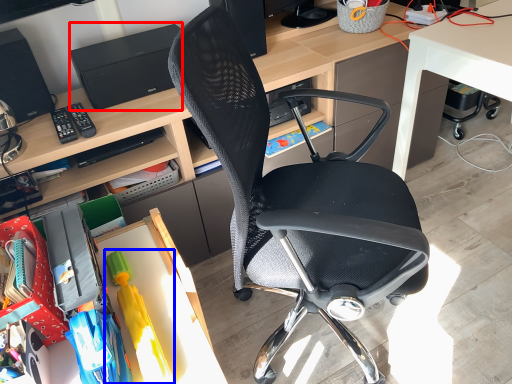
Question: Among these objects, which one is farthest to the camera, printer (highlighted by a red box) or toy (highlighted by a blue box)?

Choices:
 (A) printer
 (B) toy

Answer: (A)